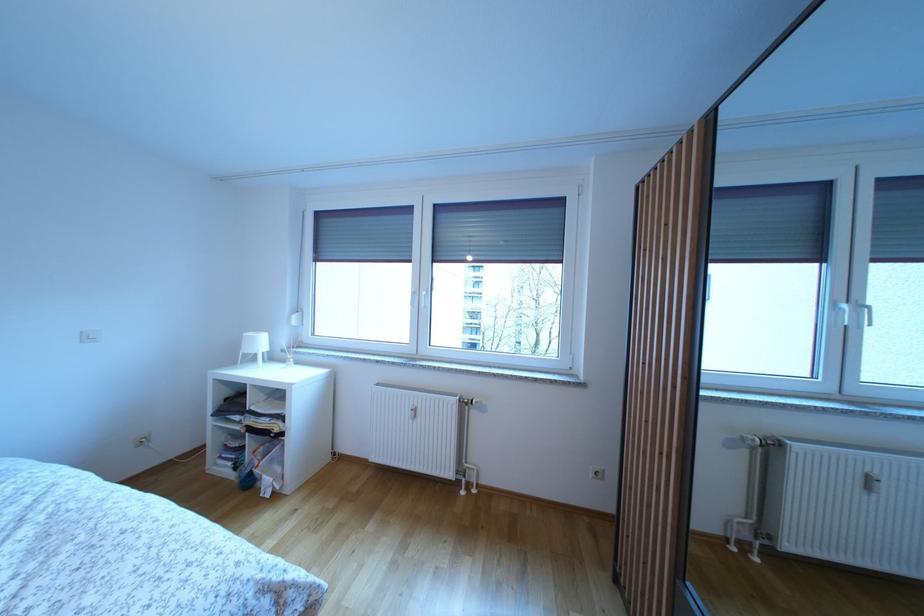
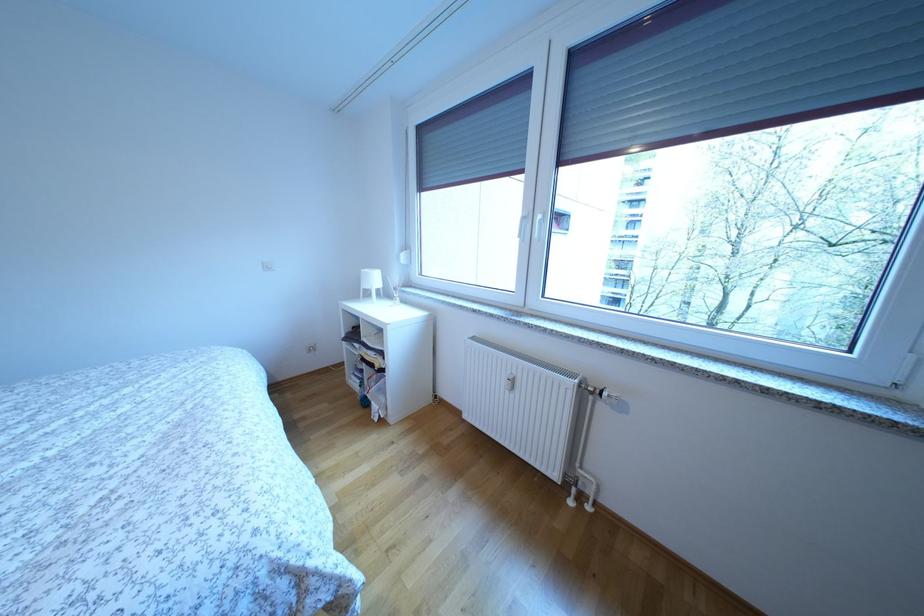
The point at (268, 349) is marked in the first image. Where is the corresponding point in the second image?

(382, 285)